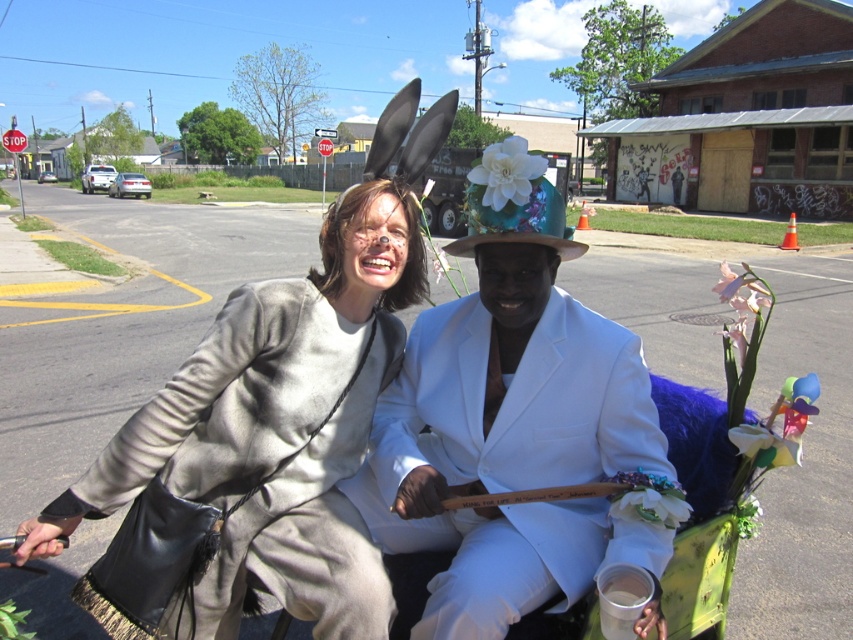
Between white satin suit at center and matte gray coat at center, which one appears on the right side from the viewer's perspective?

white satin suit at center is more to the right.

Where is `white satin suit at center`? white satin suit at center is located at coordinates (511, 420).

Is white satin suit at center taller than floral fabric hat at center?

Correct, white satin suit at center is much taller as floral fabric hat at center.

Is point (463, 380) closer to camera compared to point (537, 193)?

No, it is behind (537, 193).

Where is `white satin suit at center`? The height and width of the screenshot is (640, 853). white satin suit at center is located at coordinates (511, 420).

Is matte gray coat at center in front of floral fabric hat at center?

Yes, it is.

Is matte gray coat at center below floral fabric hat at center?

Indeed, matte gray coat at center is positioned under floral fabric hat at center.

Image resolution: width=853 pixels, height=640 pixels. Find the location of `matte gray coat at center`. matte gray coat at center is located at coordinates (276, 428).